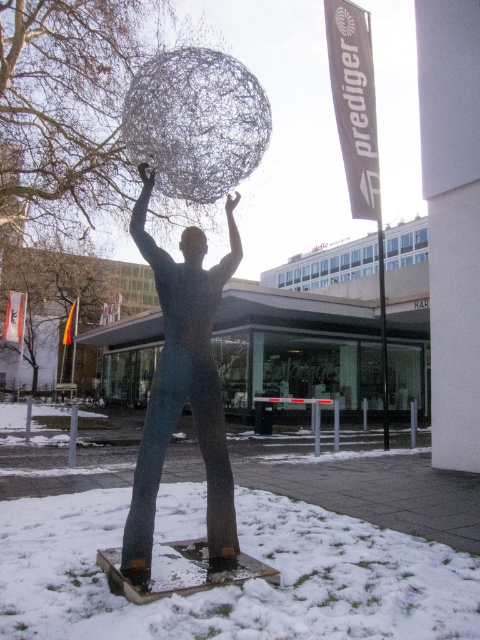
You are standing in front of the sculpture and want to take a photo that includes both the point at coordinates point [137,244] and point [188,253]. Which point should you position closer to the camera to ensure both are in focus?

To ensure both points are in focus, you should position the camera so that point [137,244] is closer since it is in front of point [188,253]. This way, the depth of field will cover both points more effectively.

You are an artist planning to photograph the metallic wire sculpture at center and the smooth skin head at center. Since you want to ensure both are visible in the frame, which object should you focus on to capture their relative sizes accurately?

Answer: The metallic wire sculpture at center is bigger than the smooth skin head at center, so focusing on the metallic wire sculpture at center will help capture their relative sizes accurately.